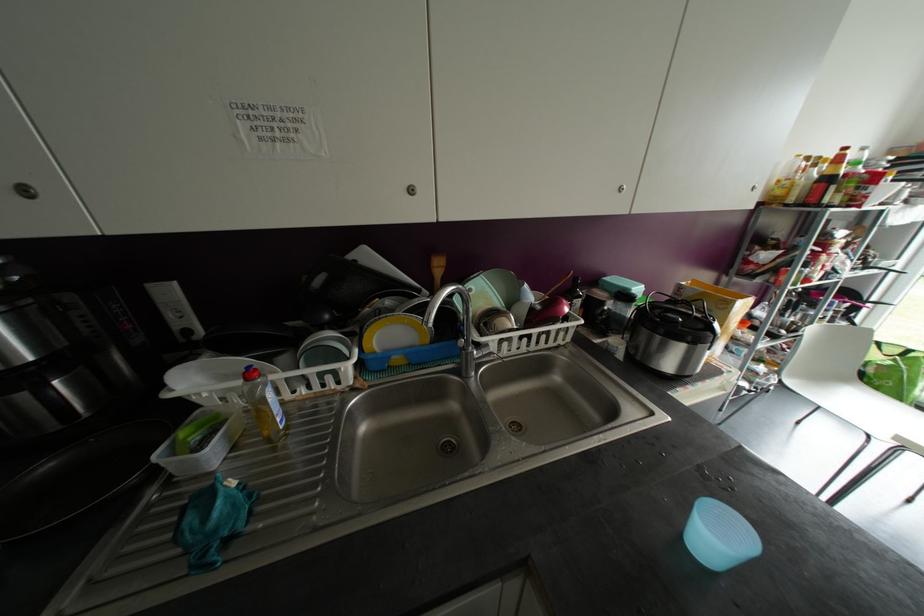
Where would you lift the yellow-capped bottle? Please return your answer as a coordinate pair (x, y).

(263, 405)